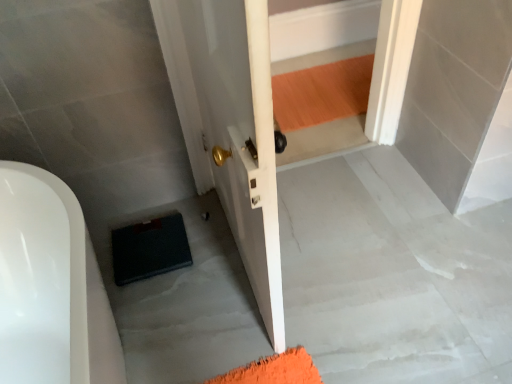
Question: Would you say dark blue rubber mat at lower left is inside or outside black matte suitcase at lower left?

Choices:
 (A) inside
 (B) outside

Answer: (B)

Question: Does point (112, 243) appear closer or farther from the camera than point (241, 304)?

Choices:
 (A) farther
 (B) closer

Answer: (A)

Question: From the image's perspective, is dark blue rubber mat at lower left above or below black matte suitcase at lower left?

Choices:
 (A) above
 (B) below

Answer: (A)

Question: In terms of height, does black matte suitcase at lower left look taller or shorter compared to dark blue rubber mat at lower left?

Choices:
 (A) short
 (B) tall

Answer: (A)

Question: Considering their positions, is black matte suitcase at lower left located in front of or behind dark blue rubber mat at lower left?

Choices:
 (A) behind
 (B) front

Answer: (B)

Question: Based on their positions, is black matte suitcase at lower left located to the left or right of dark blue rubber mat at lower left?

Choices:
 (A) left
 (B) right

Answer: (B)

Question: From the image's perspective, is black matte suitcase at lower left positioned above or below dark blue rubber mat at lower left?

Choices:
 (A) above
 (B) below

Answer: (B)